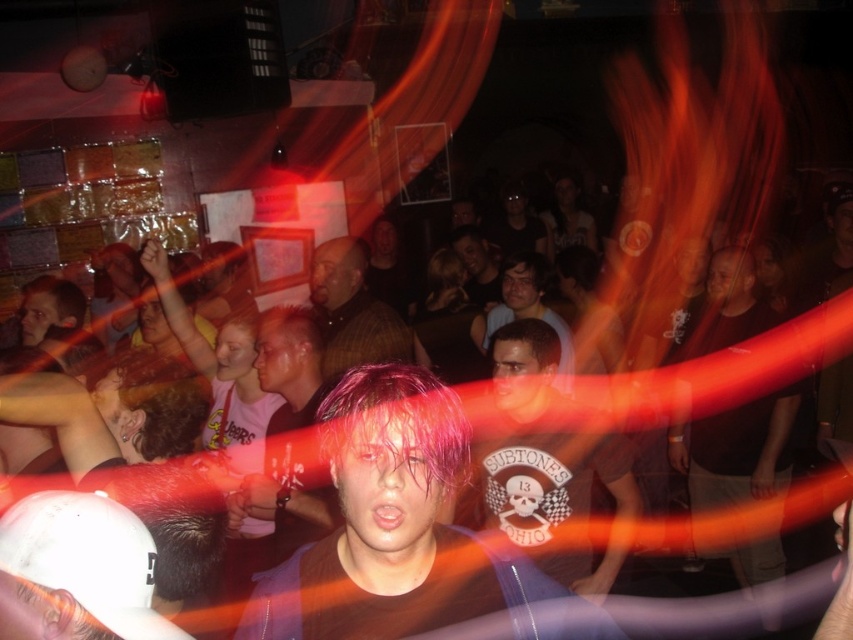
You are a photographer at the back of the venue trying to capture a clear photo of both the shiny purple hair at center and the matte brown shirt at center. Which object should you focus on first to ensure both are in focus?

The shiny purple hair at center is closer to the viewer than the matte brown shirt at center. To ensure both are in focus, focus on the shiny purple hair at center first since it is closer, and adjust the depth of field accordingly.

You are a photographer trying to capture a candid shot of the shiny purple hair at center and the matte brown shirt at center. Given that your camera has a depth of field that can focus on objects within 1 meter of each other, will both subjects be in focus?

The shiny purple hair at center is 1.10 meters from matte brown shirt at center. Since the distance between them exceeds the camera lens depth of field range of 1 meter, only one subject will be in focus.

You are a photographer trying to capture a clear shot of the two subjects in the center of the scene. The plaid shirt at center and the smooth brown hair at center. Given their relative sizes in the image, which one do you think is closer to the camera?

The plaid shirt at center has a larger size compared to smooth brown hair at center, so it is closer to the camera.